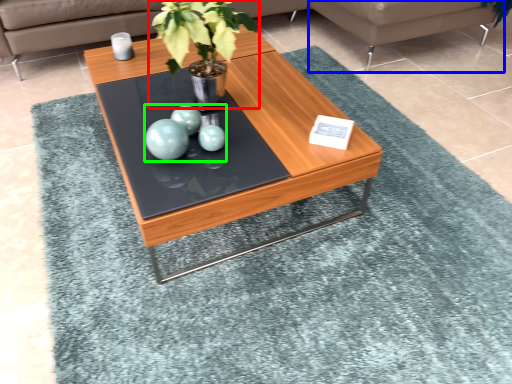
Question: Considering the real-world distances, which object is closest to houseplant (highlighted by a red box)? couch (highlighted by a blue box) or teal (highlighted by a green box).

Choices:
 (A) couch
 (B) teal

Answer: (B)